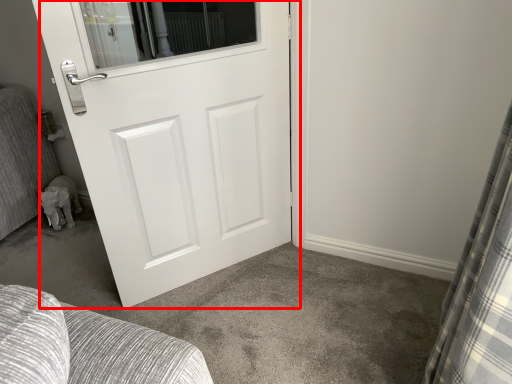
Question: From the image's perspective, considering the relative positions of door (annotated by the red box) and curtain in the image provided, where is door (annotated by the red box) located with respect to the staircase?

Choices:
 (A) above
 (B) below

Answer: (A)